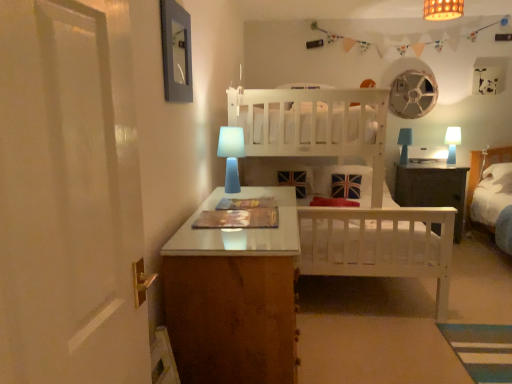
Question: From the image's perspective, relative to blue matte table lamp at center, which appears as the first table lamp when viewed from the left, is blue matte table lamp at right, acting as the third table lamp starting from the left, above or below?

Choices:
 (A) above
 (B) below

Answer: (A)

Question: From a real-world perspective, relative to blue matte table lamp at center, acting as the 3th table lamp starting from the right, is blue matte table lamp at right, arranged as the second table lamp when viewed from the back, vertically above or below?

Choices:
 (A) above
 (B) below

Answer: (B)

Question: Which object is positioned farthest from the blue matte table lamp at right, arranged as the second table lamp when viewed from the back?

Choices:
 (A) blue matte table lamp at center, acting as the 3th table lamp starting from the right
 (B) white fabric pillow at right
 (C) blue matte table lamp at right, which is counted as the 2th table lamp, starting from the left
 (D) dark wood nightstand at center
 (E) bamboo lampshade at upper center

Answer: (A)

Question: Which is farther from the bamboo lampshade at upper center?

Choices:
 (A) matte gray picture frame at upper left
 (B) blue matte table lamp at right, acting as the third table lamp starting from the left
 (C) white fabric pillow at right
 (D) blue matte table lamp at right, the first table lamp from the back
 (E) dark wood nightstand at center

Answer: (A)